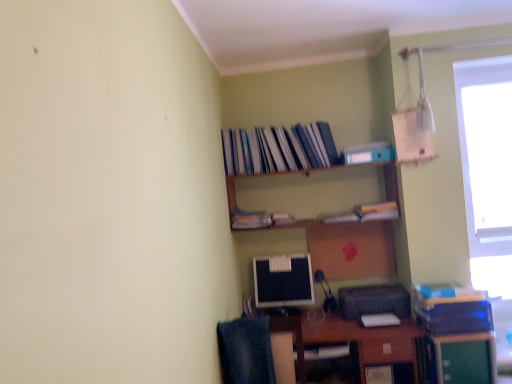
Question: Considering the relative sizes of hardcover books at upper center, the 1th book viewed from the top, and blue matte paperback book at lower right, the first paperback book in the bottom-to-top sequence, in the image provided, is hardcover books at upper center, the 1th book viewed from the top, shorter than blue matte paperback book at lower right, the first paperback book in the bottom-to-top sequence,?

Choices:
 (A) yes
 (B) no

Answer: (B)

Question: Is hardcover books at upper center, marked as the 3th book in a bottom-to-top arrangement, to the right of blue matte paperback book at lower right, the first paperback book in the bottom-to-top sequence, from the viewer's perspective?

Choices:
 (A) yes
 (B) no

Answer: (B)

Question: From the image's perspective, is hardcover books at upper center, marked as the 3th book in a bottom-to-top arrangement, beneath blue matte paperback book at lower right, which is counted as the 1th paperback book, starting from the right?

Choices:
 (A) no
 (B) yes

Answer: (A)

Question: From the image's perspective, does hardcover books at upper center, the 1th book viewed from the top, appear higher than blue matte paperback book at lower right, positioned as the 2th paperback book in back-to-front order?

Choices:
 (A) yes
 (B) no

Answer: (A)

Question: Are hardcover books at upper center, marked as the 3th book in a bottom-to-top arrangement, and blue matte paperback book at lower right, positioned as the 2th paperback book in back-to-front order, far apart?

Choices:
 (A) yes
 (B) no

Answer: (A)

Question: Would you say hardcover books at upper center, marked as the 3th book in a bottom-to-top arrangement, is to the left or to the right of black plastic printer at lower right in the picture?

Choices:
 (A) right
 (B) left

Answer: (B)

Question: Is hardcover books at upper center, marked as the 3th book in a bottom-to-top arrangement, inside or outside of black plastic printer at lower right?

Choices:
 (A) outside
 (B) inside

Answer: (A)

Question: From a real-world perspective, is hardcover books at upper center, marked as the 3th book in a bottom-to-top arrangement, positioned above or below black plastic printer at lower right?

Choices:
 (A) below
 (B) above

Answer: (B)

Question: From the image's perspective, is hardcover books at upper center, marked as the 3th book in a bottom-to-top arrangement, above or below black plastic printer at lower right?

Choices:
 (A) above
 (B) below

Answer: (A)

Question: From the image's perspective, is hardcover book at upper center, positioned as the third book in top-to-bottom order, positioned above or below light blue matte paperback book at upper center, which ranks as the 1th paperback book in top-to-bottom order?

Choices:
 (A) below
 (B) above

Answer: (A)

Question: Looking at their shapes, would you say hardcover book at upper center, positioned as the third book in top-to-bottom order, is wider or thinner than light blue matte paperback book at upper center, which is the 2th paperback book from right to left?

Choices:
 (A) wide
 (B) thin

Answer: (B)

Question: From a real-world perspective, relative to light blue matte paperback book at upper center, the 2th paperback book in the front-to-back sequence, is hardcover book at upper center, positioned as the third book in top-to-bottom order, vertically above or below?

Choices:
 (A) below
 (B) above

Answer: (A)

Question: Considering their positions, is hardcover book at upper center, which ranks as the 1th book in bottom-to-top order, located in front of or behind light blue matte paperback book at upper center, the 2th paperback book in the front-to-back sequence?

Choices:
 (A) front
 (B) behind

Answer: (B)

Question: Relative to wooden shelf at upper center, is brown wooden desk at lower center in front or behind?

Choices:
 (A) front
 (B) behind

Answer: (A)

Question: In the image, is brown wooden desk at lower center on the left side or the right side of wooden shelf at upper center?

Choices:
 (A) right
 (B) left

Answer: (A)